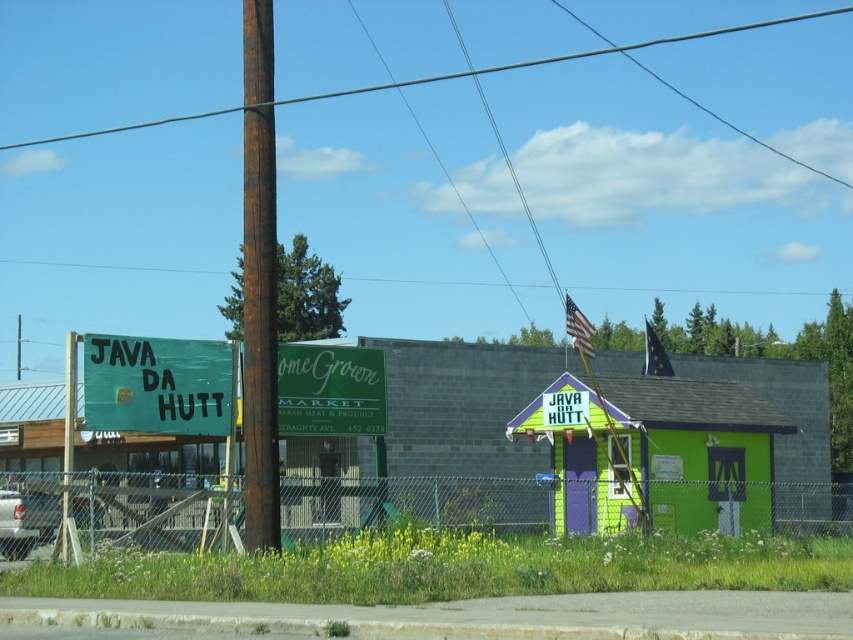
Looking at this image, is rusty wood pole at center above brown wooden pole at upper center?

Actually, rusty wood pole at center is below brown wooden pole at upper center.

Which of these two, rusty wood pole at center or brown wooden pole at upper center, stands shorter?

rusty wood pole at center

You are a GUI agent. You are given a task and a screenshot of the screen. Output one action in this format:
    pyautogui.click(x=<x>, y=<y>)
    Task: Click on the rusty wood pole at center
    This screenshot has height=640, width=853.
    Given the screenshot: What is the action you would take?
    pyautogui.click(x=259, y=282)

Locate an element on the screen. This screenshot has height=640, width=853. rusty wood pole at center is located at coordinates (259, 282).

Who is taller, green matte signboard at left or brown wooden pole at upper center?

brown wooden pole at upper center

Which of these two, green matte signboard at left or brown wooden pole at upper center, stands shorter?

Standing shorter between the two is green matte signboard at left.

This screenshot has height=640, width=853. What do you see at coordinates (158, 385) in the screenshot? I see `green matte signboard at left` at bounding box center [158, 385].

The height and width of the screenshot is (640, 853). Find the location of `green matte signboard at left`. green matte signboard at left is located at coordinates (158, 385).

Does point (347, 502) lie behind point (88, 358)?

Yes, it is.

Who is more forward, (520, 497) or (218, 428)?

Point (218, 428)

The width and height of the screenshot is (853, 640). I want to click on metal chain-link fence at lower center, so click(x=416, y=502).